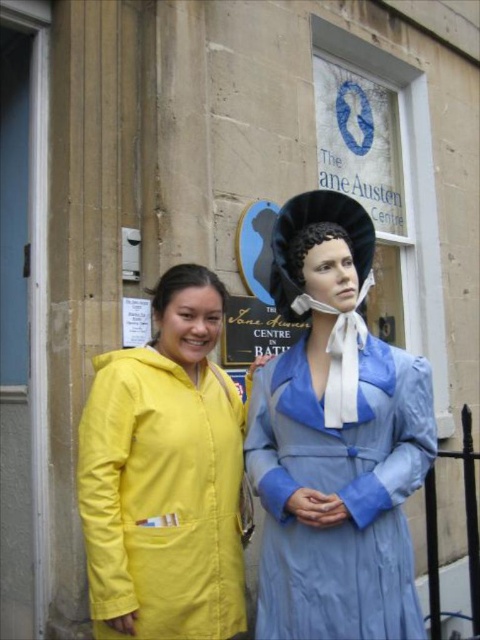
Question: Is yellow matte coat at center behind light blue satin dress at center?

Choices:
 (A) no
 (B) yes

Answer: (B)

Question: Which point appears closest to the camera in this image?

Choices:
 (A) (346, 593)
 (B) (226, 531)

Answer: (A)

Question: Is yellow matte coat at center to the left of light blue satin dress at center from the viewer's perspective?

Choices:
 (A) no
 (B) yes

Answer: (B)

Question: Can you confirm if yellow matte coat at center is positioned above light blue satin dress at center?

Choices:
 (A) no
 (B) yes

Answer: (B)

Question: Among these points, which one is farthest from the camera?

Choices:
 (A) (163, 483)
 (B) (363, 442)

Answer: (A)